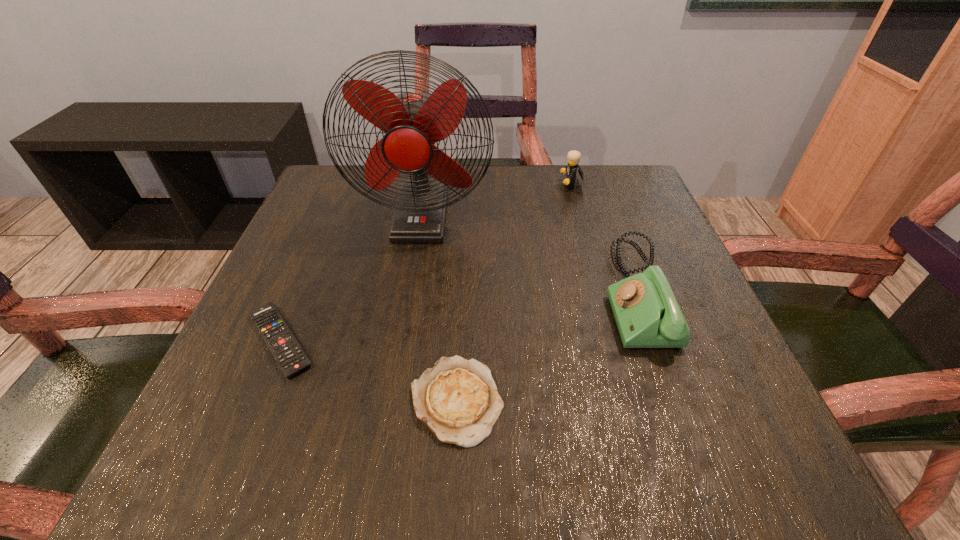
At what (x,y) coordinates should I click in order to perform the action: click on free space at the near right corner of the desktop. Please return your answer as a coordinate pair (x, y). This screenshot has width=960, height=540. Looking at the image, I should click on (737, 434).

This screenshot has height=540, width=960. I want to click on free spot between the fan and the remote control, so click(x=350, y=278).

You are a GUI agent. You are given a task and a screenshot of the screen. Output one action in this format:
    pyautogui.click(x=<x>, y=<y>)
    Task: Click on the free spot between the Lego and the remote control
    The width and height of the screenshot is (960, 540).
    Given the screenshot: What is the action you would take?
    pyautogui.click(x=426, y=263)

This screenshot has height=540, width=960. I want to click on empty space that is in between the tallest object and the second shortest object, so click(439, 308).

Where is `vacant point located between the fan and the quiche`? vacant point located between the fan and the quiche is located at coordinates (439, 308).

Where is `vacant region between the fan and the remote control`? This screenshot has width=960, height=540. vacant region between the fan and the remote control is located at coordinates (x=350, y=278).

The height and width of the screenshot is (540, 960). Identify the location of empty location between the Lego and the tallest object. (496, 201).

This screenshot has width=960, height=540. In order to click on vacant area that lies between the remote control and the tallest object in this screenshot , I will do [x=350, y=278].

This screenshot has height=540, width=960. What are the coordinates of `vacant area between the shortest object and the fan` in the screenshot? It's located at (350, 278).

What are the coordinates of `free area in between the quiche and the Lego` in the screenshot? It's located at (515, 293).